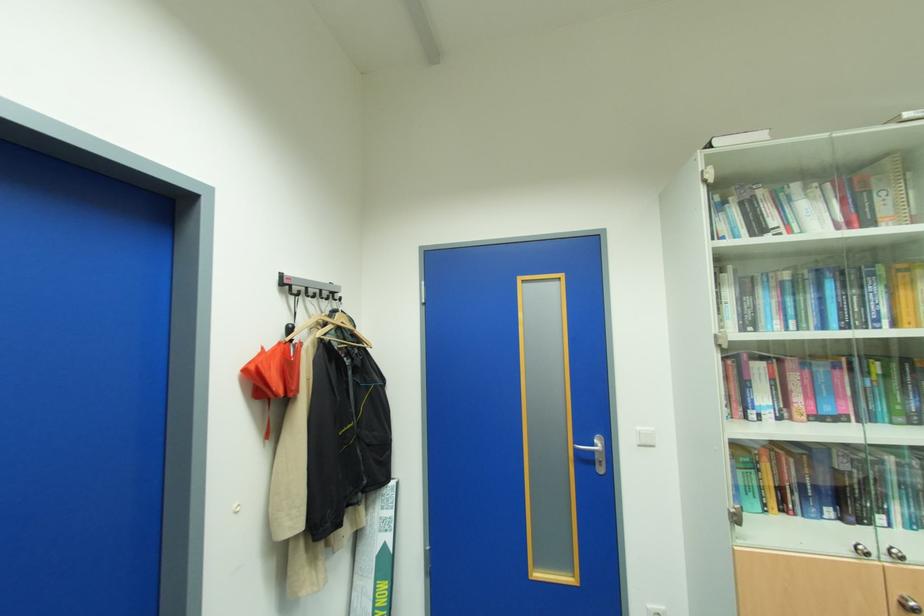
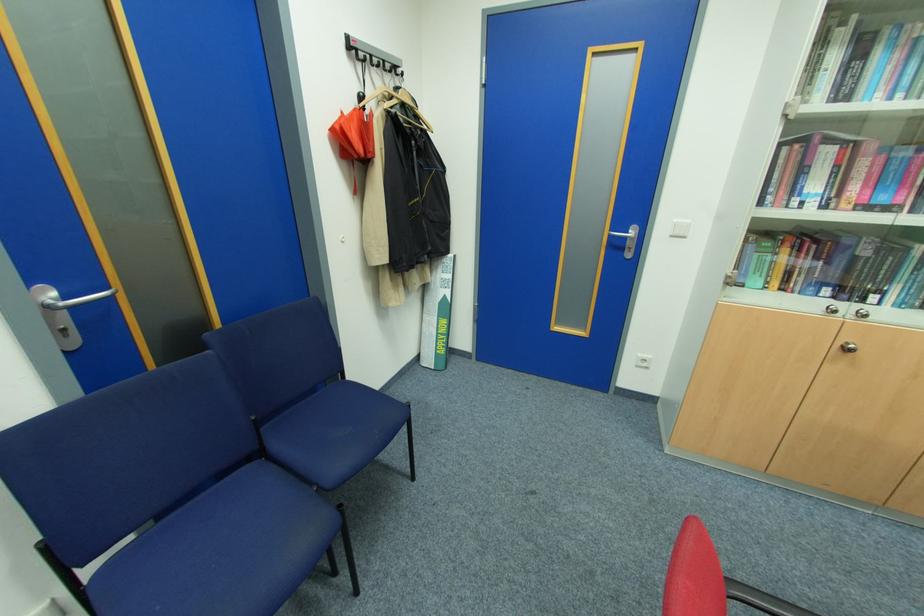
The point at (890, 557) is marked in the first image. Where is the corresponding point in the second image?

(855, 315)